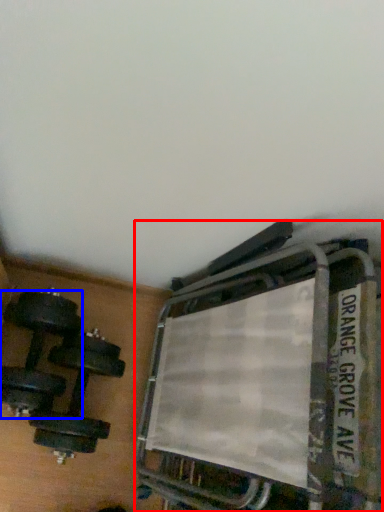
Question: Which of the following is the farthest to the observer, bunk bed (highlighted by a red box) or dumbbell (highlighted by a blue box)?

Choices:
 (A) bunk bed
 (B) dumbbell

Answer: (B)